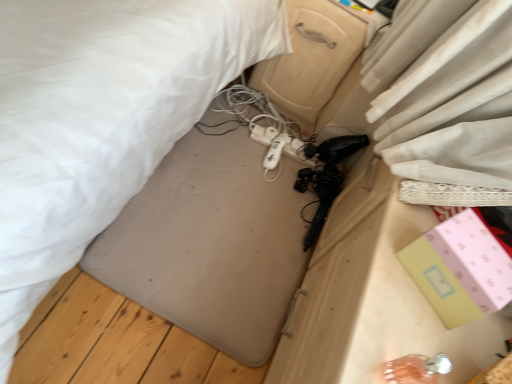
Question: Relative to beige plastic drawer at center, is white plastic hairdryer at center in front or behind?

Choices:
 (A) behind
 (B) front

Answer: (A)

Question: Is point (275, 142) positioned closer to the camera than point (322, 13)?

Choices:
 (A) farther
 (B) closer

Answer: (A)

Question: Which object is positioned farthest from the beige plastic drawer at center?

Choices:
 (A) pink paper box at lower right
 (B) white fabric bed at center
 (C) white plastic extension cord at center
 (D) white plastic hairdryer at center

Answer: (A)

Question: Estimate the real-world distances between objects in this image. Which object is farther from the white plastic extension cord at center?

Choices:
 (A) pink paper box at lower right
 (B) white fabric bed at center
 (C) white plastic hairdryer at center
 (D) beige plastic drawer at center

Answer: (A)